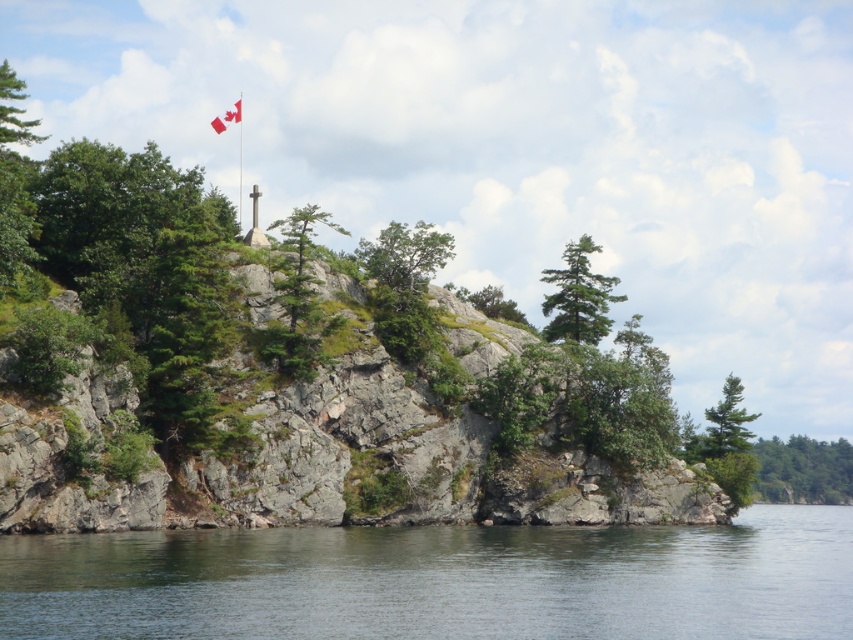
Question: Which of the following is the farthest from the observer?

Choices:
 (A) green leafy tree at lower right
 (B) metallic flag pole at upper center
 (C) white fabric flag at upper center
 (D) green matte tree at right

Answer: (C)

Question: In this image, where is green leafy tree at lower right located relative to green matte tree at right?

Choices:
 (A) right
 (B) left

Answer: (A)

Question: Can you confirm if green leafy tree at lower right is positioned to the left of green matte tree at right?

Choices:
 (A) no
 (B) yes

Answer: (A)

Question: Does green leafy tree at center appear on the left side of green matte tree at right?

Choices:
 (A) no
 (B) yes

Answer: (B)

Question: Which object is closer to the camera taking this photo?

Choices:
 (A) green leafy tree at center
 (B) green matte tree at center

Answer: (A)

Question: Among these points, which one is nearest to the camera?

Choices:
 (A) (585, 243)
 (B) (317, 336)
 (C) (236, 112)
 (D) (708, 429)

Answer: (B)